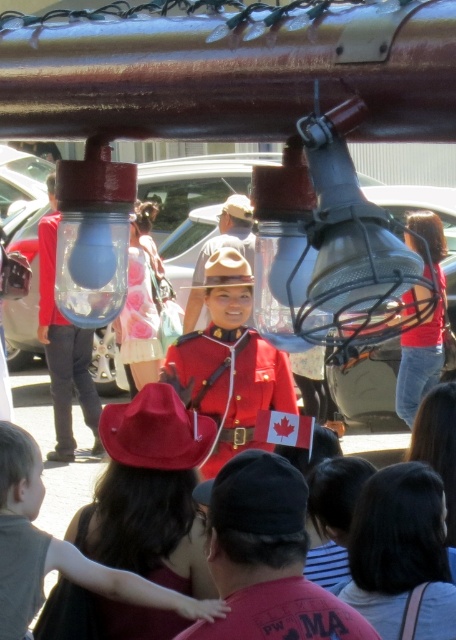
Question: Does red uniform at center have a greater width compared to red felt cowboy hat at center?

Choices:
 (A) yes
 (B) no

Answer: (A)

Question: Is red uniform at center below matte red cowboy hat at lower left?

Choices:
 (A) no
 (B) yes

Answer: (A)

Question: Observing the image, what is the correct spatial positioning of red uniform at center in reference to red felt cowboy hat at center?

Choices:
 (A) left
 (B) right

Answer: (B)

Question: Among these points, which one is nearest to the camera?

Choices:
 (A) (57, 545)
 (B) (211, 276)

Answer: (A)

Question: Which of the following is the closest to the observer?

Choices:
 (A) matte red cowboy hat at lower left
 (B) red uniform at center

Answer: (A)

Question: Among these points, which one is nearest to the camera?

Choices:
 (A) (148, 461)
 (B) (214, 276)
 (C) (10, 465)
 (D) (195, 348)

Answer: (C)